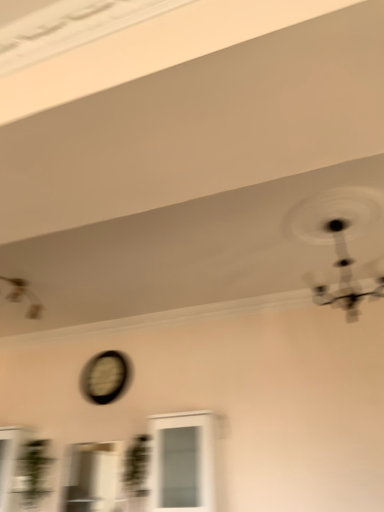
Where is `metallic silver mechanical fan at upper right, which is counted as the second mechanical fan, starting from the back`? metallic silver mechanical fan at upper right, which is counted as the second mechanical fan, starting from the back is located at coordinates (338, 241).

Image resolution: width=384 pixels, height=512 pixels. Describe the element at coordinates (23, 296) in the screenshot. I see `metallic silver mechanical fan at upper left, positioned as the second mechanical fan in front-to-back order` at that location.

Identify the location of matte black clock at center. This screenshot has height=512, width=384. (104, 377).

Is white glass cabinet at center, positioned as the 2th window in left-to-right order, bigger or smaller than matte black clock at center?

white glass cabinet at center, positioned as the 2th window in left-to-right order, is bigger than matte black clock at center.

In the image, is white glass cabinet at center, the first window in the right-to-left sequence, on the left side or the right side of matte black clock at center?

From the image, it's evident that white glass cabinet at center, the first window in the right-to-left sequence, is to the right of matte black clock at center.

Which object is thinner, white glass cabinet at center, the first window in the right-to-left sequence, or matte black clock at center?

With smaller width is matte black clock at center.

Could you tell me if clear glass window at center, marked as the 1th window in a left-to-right arrangement, is facing metallic silver mechanical fan at upper right, which is counted as the second mechanical fan, starting from the back?

No, clear glass window at center, marked as the 1th window in a left-to-right arrangement, is not aimed at metallic silver mechanical fan at upper right, which is counted as the second mechanical fan, starting from the back.

Considering the positions of point (114, 450) and point (370, 272), is point (114, 450) closer or farther from the camera than point (370, 272)?

Clearly, point (114, 450) is more distant from the camera than point (370, 272).

From a real-world perspective, is clear glass window at center, marked as the 1th window in a left-to-right arrangement, physically above metallic silver mechanical fan at upper right, which is counted as the second mechanical fan, starting from the back?

No, from a real-world perspective, clear glass window at center, marked as the 1th window in a left-to-right arrangement, is not over metallic silver mechanical fan at upper right, which is counted as the second mechanical fan, starting from the back

Is point (5, 277) less distant than point (124, 372)?

That is True.

Where is `the 1st mechanical fan in front of the matte black clock at center`? Image resolution: width=384 pixels, height=512 pixels. the 1st mechanical fan in front of the matte black clock at center is located at coordinates (23, 296).

Is metallic silver mechanical fan at upper left, positioned as the second mechanical fan in front-to-back order, facing towards matte black clock at center?

No, metallic silver mechanical fan at upper left, positioned as the second mechanical fan in front-to-back order, is not aimed at matte black clock at center.

Between metallic silver mechanical fan at upper left, the 2th mechanical fan in the right-to-left sequence, and matte black clock at center, which one appears on the right side from the viewer's perspective?

From the viewer's perspective, matte black clock at center appears more on the right side.

Is matte black clock at center not close to clear glass window at center, positioned as the 2th window in right-to-left order?

No, matte black clock at center is in close proximity to clear glass window at center, positioned as the 2th window in right-to-left order.

Based on the photo, does matte black clock at center have a lesser height compared to clear glass window at center, positioned as the 2th window in right-to-left order?

Indeed, matte black clock at center has a lesser height compared to clear glass window at center, positioned as the 2th window in right-to-left order.

Which point is more distant from viewer, (92, 371) or (90, 496)?

The point (92, 371) is more distant.

How many degrees apart are the facing directions of matte black clock at center and clear glass window at center, marked as the 1th window in a left-to-right arrangement?

matte black clock at center and clear glass window at center, marked as the 1th window in a left-to-right arrangement, are facing 0.000168 degrees away from each other.

Which is behind, point (325, 242) or point (38, 310)?

The point (38, 310) is behind.

Is metallic silver mechanical fan at upper left, the 2th mechanical fan in the right-to-left sequence, completely or partially inside metallic silver mechanical fan at upper right, the first mechanical fan from the front?

No.

At what (x,y) coordinates should I click in order to perform the action: click on window above the clear glass window at center, marked as the 1th window in a left-to-right arrangement (from the image's perspective). Please return your answer as a coordinate pair (x, y). Image resolution: width=384 pixels, height=512 pixels. Looking at the image, I should click on (183, 463).

Is clear glass window at center, marked as the 1th window in a left-to-right arrangement, a part of white glass cabinet at center, positioned as the 2th window in left-to-right order?

No, clear glass window at center, marked as the 1th window in a left-to-right arrangement, is located outside of white glass cabinet at center, positioned as the 2th window in left-to-right order.

Is white glass cabinet at center, positioned as the 2th window in left-to-right order, in contact with clear glass window at center, marked as the 1th window in a left-to-right arrangement?

white glass cabinet at center, positioned as the 2th window in left-to-right order, is not next to clear glass window at center, marked as the 1th window in a left-to-right arrangement, and they're not touching.

From the image's perspective, who appears lower, white glass cabinet at center, the first window in the right-to-left sequence, or clear glass window at center, positioned as the 2th window in right-to-left order?

clear glass window at center, positioned as the 2th window in right-to-left order, appears lower in the image.

In the image, is white glass cabinet at center, the first window in the right-to-left sequence, positioned in front of or behind metallic silver mechanical fan at upper left, positioned as the second mechanical fan in front-to-back order?

Clearly, white glass cabinet at center, the first window in the right-to-left sequence, is in front of metallic silver mechanical fan at upper left, positioned as the second mechanical fan in front-to-back order.

Could you tell me if white glass cabinet at center, the first window in the right-to-left sequence, is turned towards metallic silver mechanical fan at upper left, positioned as the first mechanical fan in back-to-front order?

No, white glass cabinet at center, the first window in the right-to-left sequence, is not aimed at metallic silver mechanical fan at upper left, positioned as the first mechanical fan in back-to-front order.

In the scene shown: From the image's perspective, who appears lower, white glass cabinet at center, the first window in the right-to-left sequence, or metallic silver mechanical fan at upper left, positioned as the second mechanical fan in front-to-back order?

white glass cabinet at center, the first window in the right-to-left sequence, from the image's perspective.

Is white glass cabinet at center, positioned as the 2th window in left-to-right order, shorter than metallic silver mechanical fan at upper left, the 2th mechanical fan in the right-to-left sequence?

No, white glass cabinet at center, positioned as the 2th window in left-to-right order, is not shorter than metallic silver mechanical fan at upper left, the 2th mechanical fan in the right-to-left sequence.

Image resolution: width=384 pixels, height=512 pixels. In order to click on clock that appears behind the white glass cabinet at center, positioned as the 2th window in left-to-right order in this screenshot , I will do `click(104, 377)`.

What are the coordinates of `window that is the 2nd one below the metallic silver mechanical fan at upper right, which is the first mechanical fan in right-to-left order (from a real-world perspective)` in the screenshot? It's located at (92, 477).

Which object lies further to the anchor point matte black clock at center, metallic silver mechanical fan at upper right, the 2th mechanical fan in the left-to-right sequence, or white glass cabinet at center, positioned as the 2th window in left-to-right order?

The object further to matte black clock at center is metallic silver mechanical fan at upper right, the 2th mechanical fan in the left-to-right sequence.

In the scene shown: Looking at the image, which one is located closer to clear glass window at center, marked as the 1th window in a left-to-right arrangement, white glass cabinet at center, positioned as the 2th window in left-to-right order, or metallic silver mechanical fan at upper left, positioned as the first mechanical fan in back-to-front order?

white glass cabinet at center, positioned as the 2th window in left-to-right order.

Considering their positions, is white glass cabinet at center, positioned as the 2th window in left-to-right order, positioned closer to metallic silver mechanical fan at upper left, the 2th mechanical fan in the right-to-left sequence, than clear glass window at center, marked as the 1th window in a left-to-right arrangement?

Based on the image, clear glass window at center, marked as the 1th window in a left-to-right arrangement, appears to be nearer to metallic silver mechanical fan at upper left, the 2th mechanical fan in the right-to-left sequence.

When comparing their distances from metallic silver mechanical fan at upper left, marked as the first mechanical fan in a left-to-right arrangement, does matte black clock at center or clear glass window at center, marked as the 1th window in a left-to-right arrangement, seem closer?

matte black clock at center lies closer to metallic silver mechanical fan at upper left, marked as the first mechanical fan in a left-to-right arrangement, than the other object.

Which object lies further to the anchor point white glass cabinet at center, positioned as the 2th window in left-to-right order, clear glass window at center, positioned as the 2th window in right-to-left order, or metallic silver mechanical fan at upper left, marked as the first mechanical fan in a left-to-right arrangement?

The object further to white glass cabinet at center, positioned as the 2th window in left-to-right order, is metallic silver mechanical fan at upper left, marked as the first mechanical fan in a left-to-right arrangement.

Looking at the image, which one is located further to clear glass window at center, marked as the 1th window in a left-to-right arrangement, metallic silver mechanical fan at upper right, the 2th mechanical fan in the left-to-right sequence, or white glass cabinet at center, positioned as the 2th window in left-to-right order?

Among the two, metallic silver mechanical fan at upper right, the 2th mechanical fan in the left-to-right sequence, is located further to clear glass window at center, marked as the 1th window in a left-to-right arrangement.

Based on their spatial positions, is white glass cabinet at center, the first window in the right-to-left sequence, or matte black clock at center further from metallic silver mechanical fan at upper left, positioned as the first mechanical fan in back-to-front order?

white glass cabinet at center, the first window in the right-to-left sequence.

Based on their spatial positions, is white glass cabinet at center, the first window in the right-to-left sequence, or metallic silver mechanical fan at upper right, which is counted as the second mechanical fan, starting from the back, further from clear glass window at center, marked as the 1th window in a left-to-right arrangement?

metallic silver mechanical fan at upper right, which is counted as the second mechanical fan, starting from the back, is further to clear glass window at center, marked as the 1th window in a left-to-right arrangement.

This screenshot has height=512, width=384. I want to click on window between metallic silver mechanical fan at upper right, the 2th mechanical fan in the left-to-right sequence, and clear glass window at center, marked as the 1th window in a left-to-right arrangement, in the vertical direction, so click(183, 463).

Where is `window between matte black clock at center and white glass cabinet at center, positioned as the 2th window in left-to-right order`? This screenshot has height=512, width=384. window between matte black clock at center and white glass cabinet at center, positioned as the 2th window in left-to-right order is located at coordinates (92, 477).

The width and height of the screenshot is (384, 512). I want to click on clock located between metallic silver mechanical fan at upper left, the 2th mechanical fan in the right-to-left sequence, and metallic silver mechanical fan at upper right, which is the first mechanical fan in right-to-left order, in the left-right direction, so click(x=104, y=377).

The image size is (384, 512). In order to click on clock situated between metallic silver mechanical fan at upper left, the 2th mechanical fan in the right-to-left sequence, and white glass cabinet at center, positioned as the 2th window in left-to-right order, from left to right in this screenshot , I will do `click(104, 377)`.